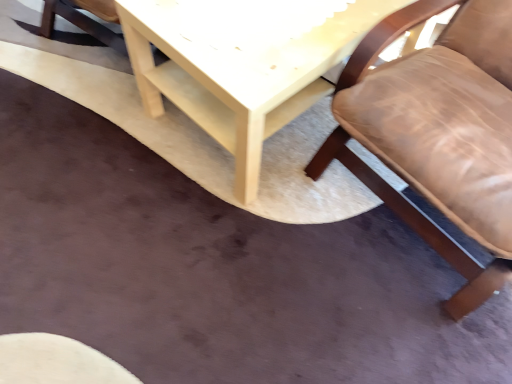
Question: Should I look upward or downward to see light wood table at upper center?

Choices:
 (A) down
 (B) up

Answer: (B)

Question: Is the surface of light wood table at upper center in direct contact with brown leather chair at upper right?

Choices:
 (A) no
 (B) yes

Answer: (A)

Question: Is light wood table at upper center looking in the opposite direction of brown leather chair at upper right?

Choices:
 (A) yes
 (B) no

Answer: (B)

Question: From a real-world perspective, does light wood table at upper center sit lower than brown leather chair at upper right?

Choices:
 (A) yes
 (B) no

Answer: (A)

Question: From a real-world perspective, is light wood table at upper center on brown leather chair at upper right?

Choices:
 (A) yes
 (B) no

Answer: (B)

Question: Is the depth of light wood table at upper center less than that of brown leather chair at upper right?

Choices:
 (A) yes
 (B) no

Answer: (B)

Question: Would you say light wood table at upper center contains brown leather chair at upper right?

Choices:
 (A) yes
 (B) no

Answer: (B)

Question: Is the position of brown leather chair at upper right less distant than that of light wood table at upper center?

Choices:
 (A) no
 (B) yes

Answer: (B)

Question: Considering the relative sizes of brown leather chair at upper right and light wood table at upper center in the image provided, is brown leather chair at upper right wider than light wood table at upper center?

Choices:
 (A) yes
 (B) no

Answer: (B)

Question: Is brown leather chair at upper right positioned behind light wood table at upper center?

Choices:
 (A) yes
 (B) no

Answer: (B)

Question: Can you confirm if brown leather chair at upper right is smaller than light wood table at upper center?

Choices:
 (A) yes
 (B) no

Answer: (B)

Question: From a real-world perspective, does brown leather chair at upper right stand above light wood table at upper center?

Choices:
 (A) no
 (B) yes

Answer: (B)

Question: From a real-world perspective, is brown leather chair at upper right located beneath light wood table at upper center?

Choices:
 (A) no
 (B) yes

Answer: (A)

Question: From the image's perspective, is brown leather chair at upper right above or below light wood table at upper center?

Choices:
 (A) below
 (B) above

Answer: (A)